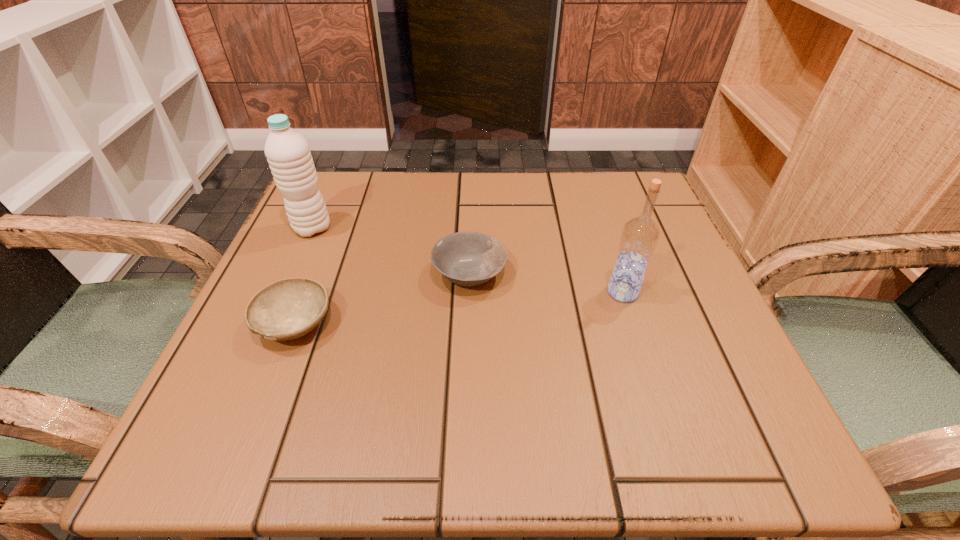
Identify the location of bowl that is at the left edge. (287, 309).

What are the coordinates of `object at the right edge` in the screenshot? It's located at (640, 235).

At what (x,y) coordinates should I click in order to perform the action: click on object at the far left corner. Please return your answer as a coordinate pair (x, y). The image size is (960, 540). Looking at the image, I should click on (289, 157).

Locate an element on the screen. free point at the far edge is located at coordinates (401, 217).

The height and width of the screenshot is (540, 960). What are the coordinates of `vacant space at the left edge of the desktop` in the screenshot? It's located at point(291,269).

The width and height of the screenshot is (960, 540). In the image, there is a desktop. In order to click on blank space at the right edge in this screenshot , I will do 656,256.

At what (x,y) coordinates should I click in order to perform the action: click on free spot at the far left corner of the desktop. Please return your answer as a coordinate pair (x, y). This screenshot has width=960, height=540. Looking at the image, I should click on (365, 177).

In the image, there is a desktop. Where is `free space at the far right corner`? free space at the far right corner is located at coordinates (612, 221).

Locate an element on the screen. This screenshot has width=960, height=540. free area in between the left bowl and the farthest object is located at coordinates (303, 276).

Where is `free space between the right bowl and the left bowl`? The image size is (960, 540). free space between the right bowl and the left bowl is located at coordinates (382, 299).